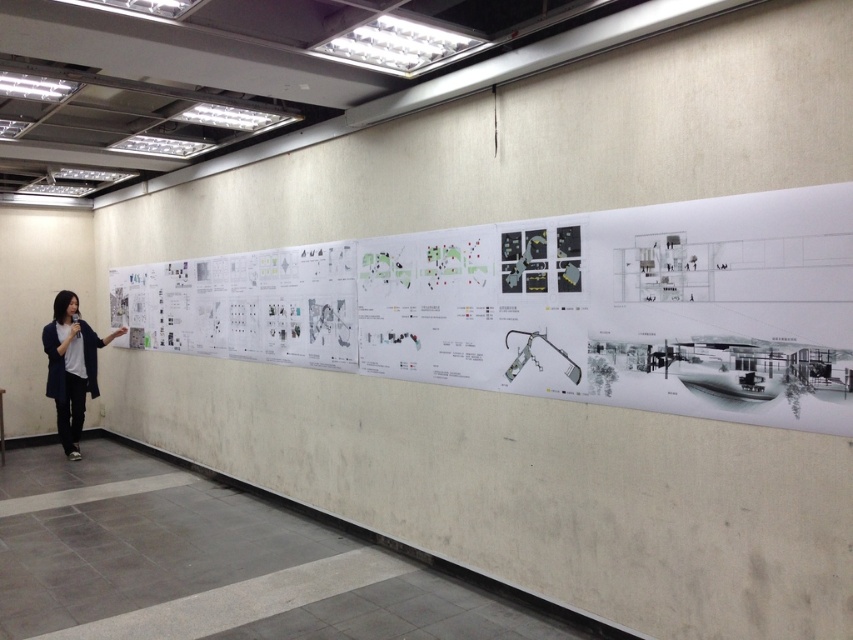
Which is more to the right, white paper at center or dark blue fabric jacket at left?

From the viewer's perspective, white paper at center appears more on the right side.

This screenshot has width=853, height=640. Identify the location of white paper at center. (548, 307).

This screenshot has width=853, height=640. Identify the location of white paper at center. (548, 307).